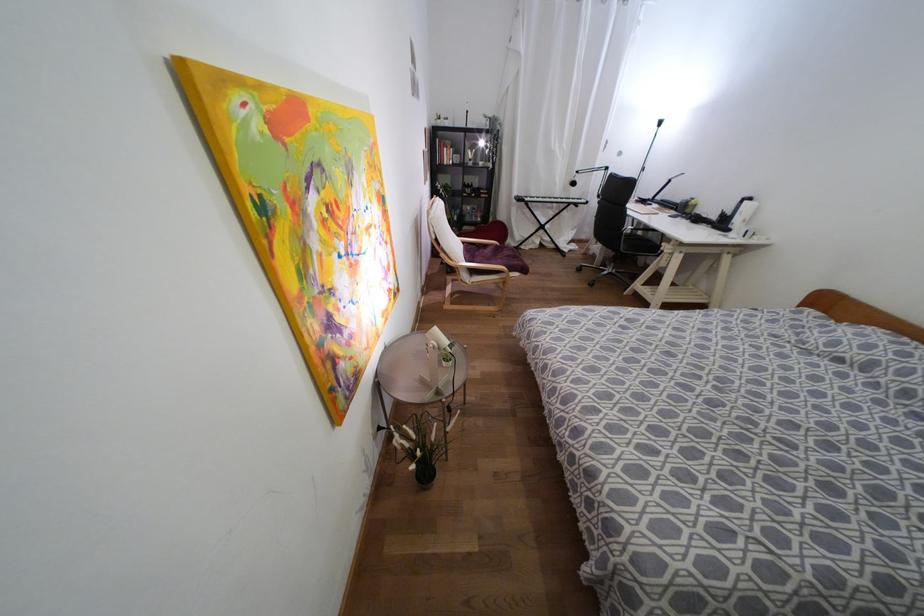
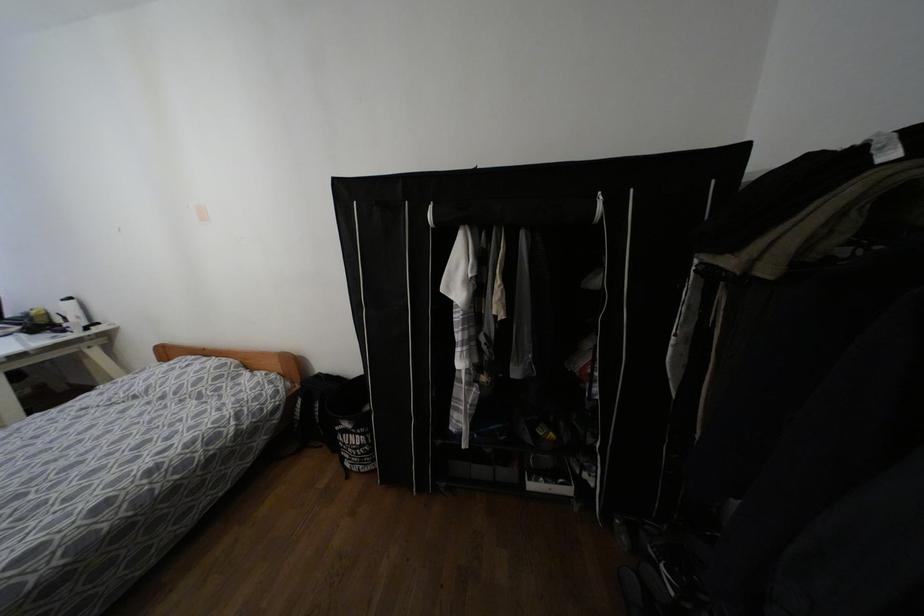
In the second image, find the point that corresponds to (x=749, y=198) in the first image.

(68, 299)